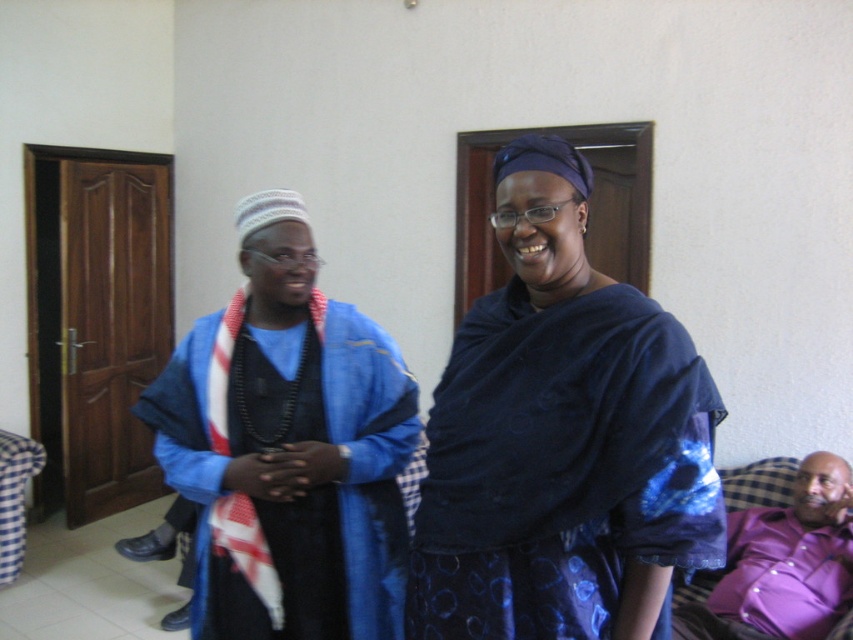
Question: Is blue satin dress at center below blue textured robe at center?

Choices:
 (A) no
 (B) yes

Answer: (A)

Question: Does blue textured robe at center have a smaller size compared to purple satin shirt at lower right?

Choices:
 (A) yes
 (B) no

Answer: (A)

Question: Which object is farther from the camera taking this photo?

Choices:
 (A) blue satin dress at center
 (B) blue textured robe at center

Answer: (B)

Question: Which point is farther to the camera?

Choices:
 (A) (339, 333)
 (B) (612, 628)

Answer: (A)

Question: Does blue satin dress at center have a smaller size compared to blue textured robe at center?

Choices:
 (A) no
 (B) yes

Answer: (A)

Question: Among these objects, which one is farthest from the camera?

Choices:
 (A) blue textured robe at center
 (B) blue satin dress at center

Answer: (A)